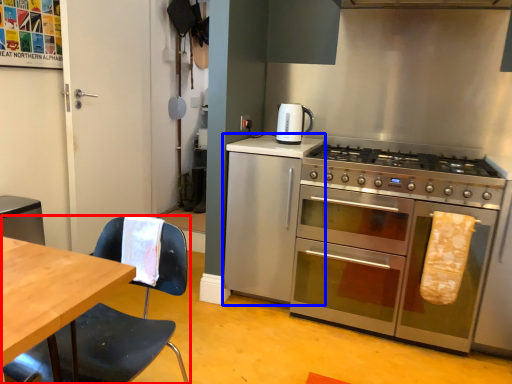
Question: Among these objects, which one is farthest to the camera, chair (highlighted by a red box) or cabinetry (highlighted by a blue box)?

Choices:
 (A) chair
 (B) cabinetry

Answer: (B)